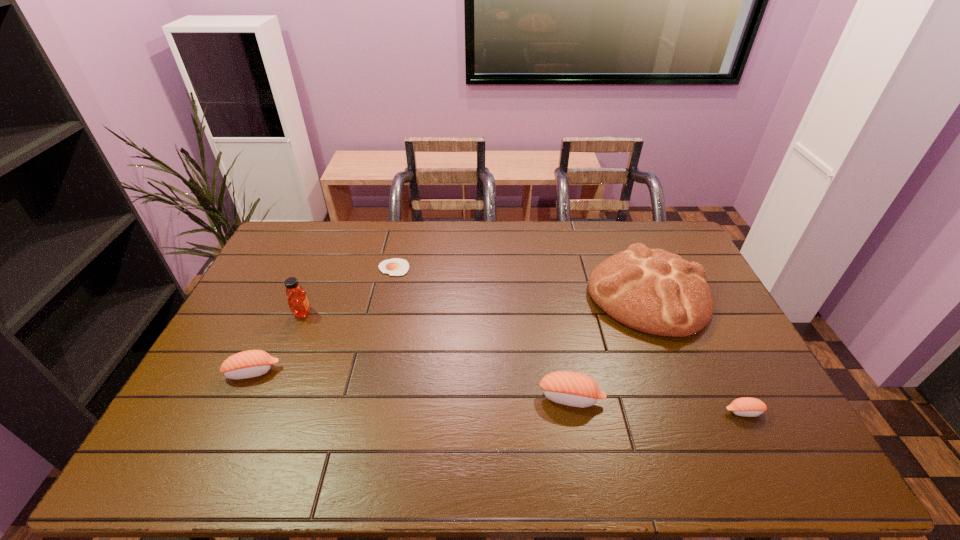
At what (x,y) coordinates should I click in order to perform the action: click on object positioned at the far right corner. Please return your answer as a coordinate pair (x, y). This screenshot has height=540, width=960. Looking at the image, I should click on (656, 292).

Where is `object present at the near right corner`? object present at the near right corner is located at coordinates (748, 407).

This screenshot has height=540, width=960. Find the location of `vacant space at the far edge of the desktop`. vacant space at the far edge of the desktop is located at coordinates (489, 248).

This screenshot has height=540, width=960. What are the coordinates of `free space at the near edge of the desktop` in the screenshot? It's located at (547, 420).

At what (x,y) coordinates should I click in order to perform the action: click on vacant space at the left edge of the desktop. Please return your answer as a coordinate pair (x, y). The height and width of the screenshot is (540, 960). Looking at the image, I should click on (275, 283).

In the image, there is a desktop. At what (x,y) coordinates should I click in order to perform the action: click on vacant space at the far left corner. Please return your answer as a coordinate pair (x, y). Looking at the image, I should click on (305, 231).

In the image, there is a desktop. Identify the location of blank space at the near left corner. The height and width of the screenshot is (540, 960). (238, 402).

Locate an element on the screen. The width and height of the screenshot is (960, 540). free region at the far right corner of the desktop is located at coordinates (678, 242).

This screenshot has height=540, width=960. I want to click on empty location between the third object from right to left and the rightmost sushi, so click(x=658, y=405).

I want to click on free space between the leftmost sushi and the shortest object, so click(324, 320).